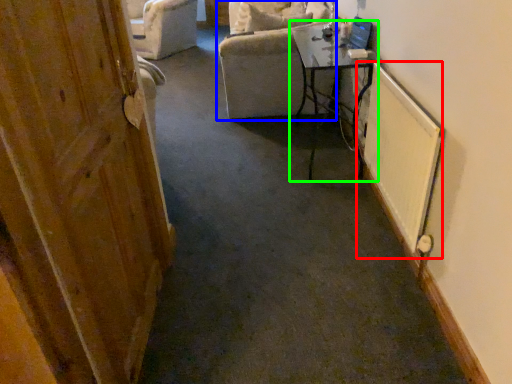
Question: Based on their relative distances, which object is nearer to radiator (highlighted by a red box)? Choose from chair (highlighted by a blue box) and table (highlighted by a green box).

Choices:
 (A) chair
 (B) table

Answer: (B)